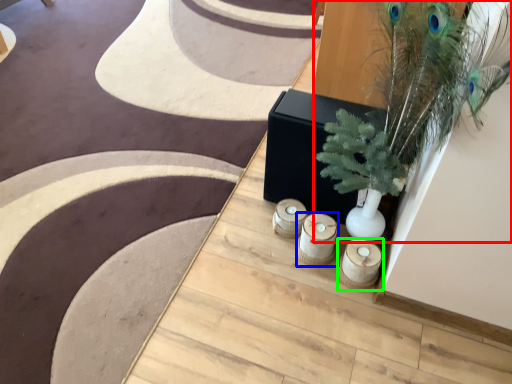
Question: Which object is positioned closest to houseplant (highlighted by a red box)? Select from candle holder (highlighted by a blue box) and candle holder (highlighted by a green box).

Choices:
 (A) candle holder
 (B) candle holder

Answer: (A)